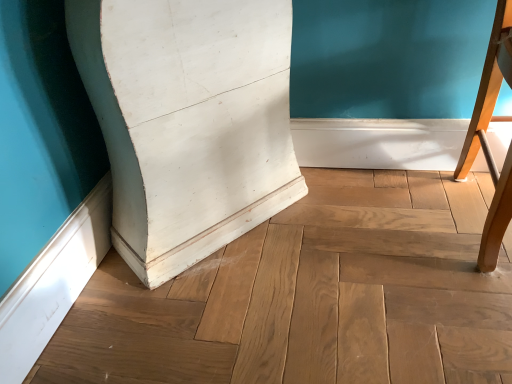
What do you see at coordinates (188, 121) in the screenshot?
I see `white painted wood pillar at center` at bounding box center [188, 121].

Image resolution: width=512 pixels, height=384 pixels. Find the location of `white painted wood pillar at center`. white painted wood pillar at center is located at coordinates (188, 121).

Find the location of a particular element. The width and height of the screenshot is (512, 384). white painted wood pillar at center is located at coordinates (188, 121).